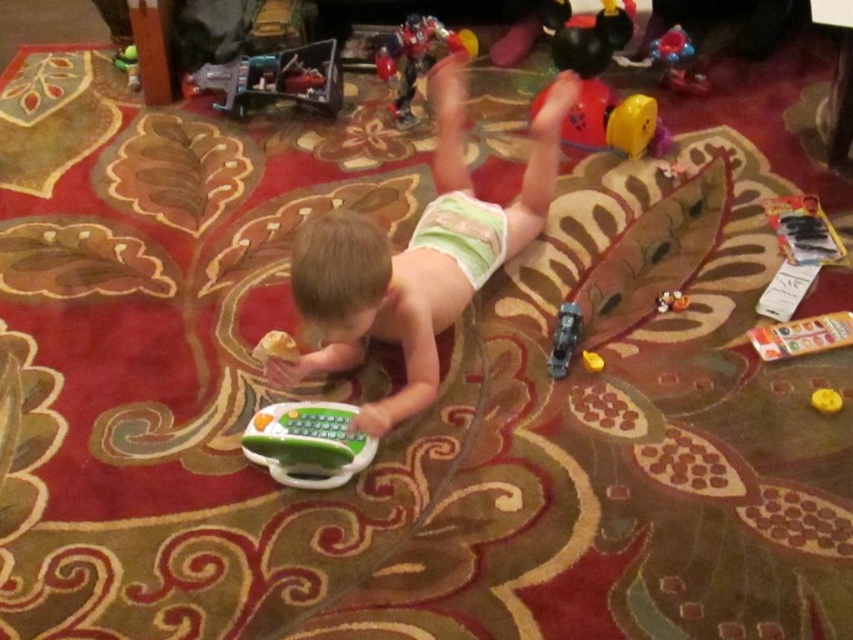
You are a parent looking at the image of your child playing. You want to pick up the rubber duck at lower right without moving the matte plastic toy at lower right. Is this possible?

The matte plastic toy at lower right is positioned over the rubber duck at lower right, so you cannot pick up the rubber duck at lower right without moving the matte plastic toy at lower right first.

You are a parent trying to choose a toy for your child to play with. You see the metallic red robot at upper center and the matte plastic toy at lower right. Which toy is taller?

The metallic red robot at upper center is taller than the matte plastic toy at lower right.

You are a parent trying to organize the child play area. You need to place the green rubber toy at center and the rubber duck at lower right on a shelf. Which object will require a taller space on the shelf?

The green rubber toy at center requires a taller space on the shelf because it has a greater height compared to the rubber duck at lower right.